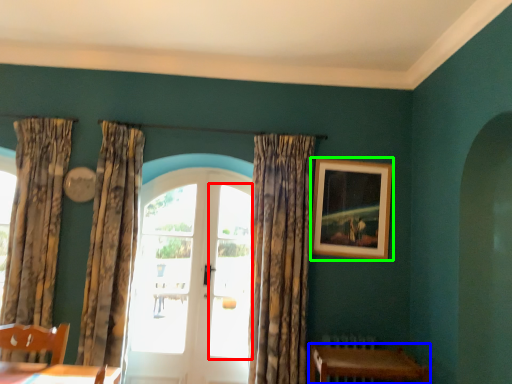
Question: Which object is positioned closest to window (highlighted by a red box)? Select from table (highlighted by a blue box) and picture frame (highlighted by a green box).

Choices:
 (A) table
 (B) picture frame

Answer: (B)